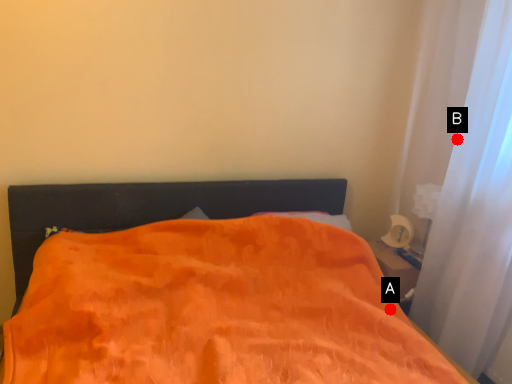
Question: Two points are circled on the image, labeled by A and B beside each circle. Which point is closer to the camera taking this photo?

Choices:
 (A) A is closer
 (B) B is closer

Answer: (A)